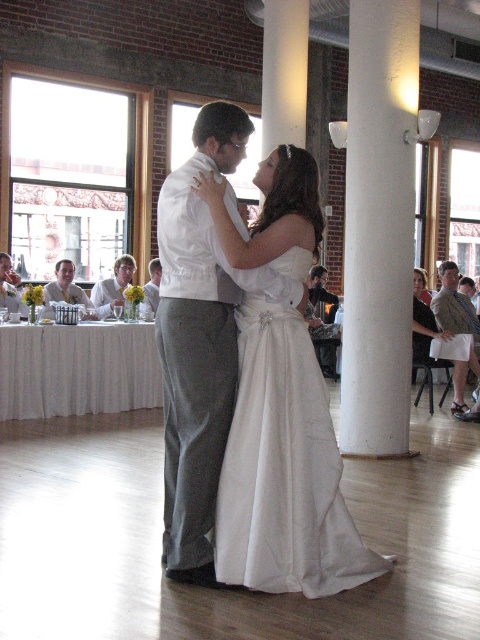
Question: Can you confirm if white satin dress at center is positioned to the right of matte gray suit at center?

Choices:
 (A) no
 (B) yes

Answer: (B)

Question: Based on their relative distances, which object is nearer to the dark brown leather jacket at center?

Choices:
 (A) matte white dress at center
 (B) gray fabric suit at right
 (C) matte gray suit at center
 (D) white satin dress at center

Answer: (B)

Question: Is white satin dress at center wider than dark brown leather jacket at center?

Choices:
 (A) no
 (B) yes

Answer: (B)

Question: From the image, what is the correct spatial relationship of gray fabric suit at right in relation to white satin suit at center?

Choices:
 (A) below
 (B) above

Answer: (A)

Question: Which of the following is the farthest from the observer?

Choices:
 (A) dark brown leather jacket at center
 (B) matte gray suit at center
 (C) white satin suit at center

Answer: (A)

Question: Which of the following is the farthest from the observer?

Choices:
 (A) white satin suit at center
 (B) white satin dress at center

Answer: (A)